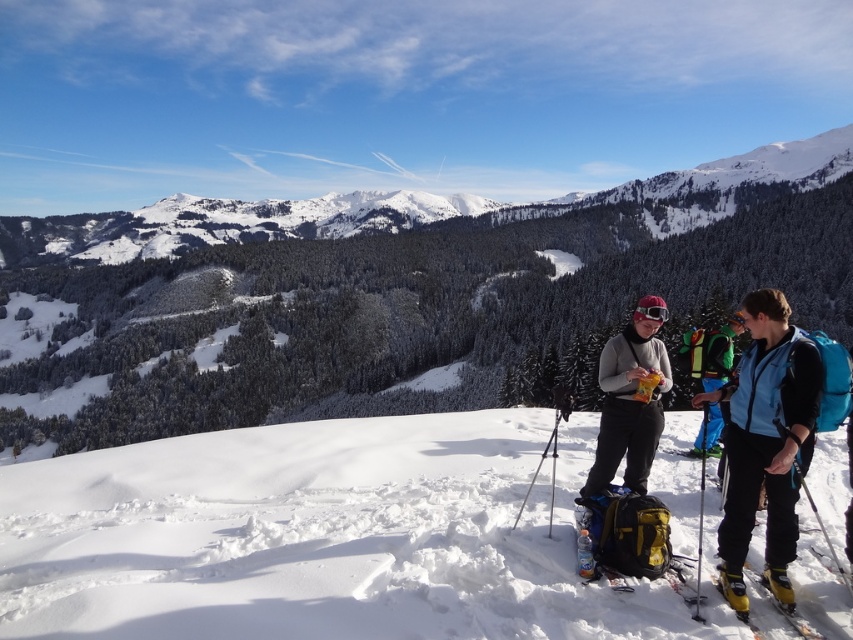
Question: Estimate the real-world distances between objects in this image. Which object is farther from the yellow fabric backpack at center?

Choices:
 (A) yellow matte ski at lower right
 (B) green fabric backpack at center

Answer: (B)

Question: Which point appears farthest from the camera in this image?

Choices:
 (A) (515, 522)
 (B) (308, 596)
 (C) (665, 540)

Answer: (A)

Question: Does metallic tripod at center have a larger size compared to yellow matte ski at lower right?

Choices:
 (A) no
 (B) yes

Answer: (B)

Question: Is the position of white snow at center less distant than that of metallic tripod at center?

Choices:
 (A) no
 (B) yes

Answer: (B)

Question: Considering the relative positions of white snow at center and yellow fabric backpack at center in the image provided, where is white snow at center located with respect to yellow fabric backpack at center?

Choices:
 (A) left
 (B) right

Answer: (A)

Question: Which of these objects is positioned closest to the white snow at center?

Choices:
 (A) matte gray jacket at center
 (B) green fabric backpack at center

Answer: (A)